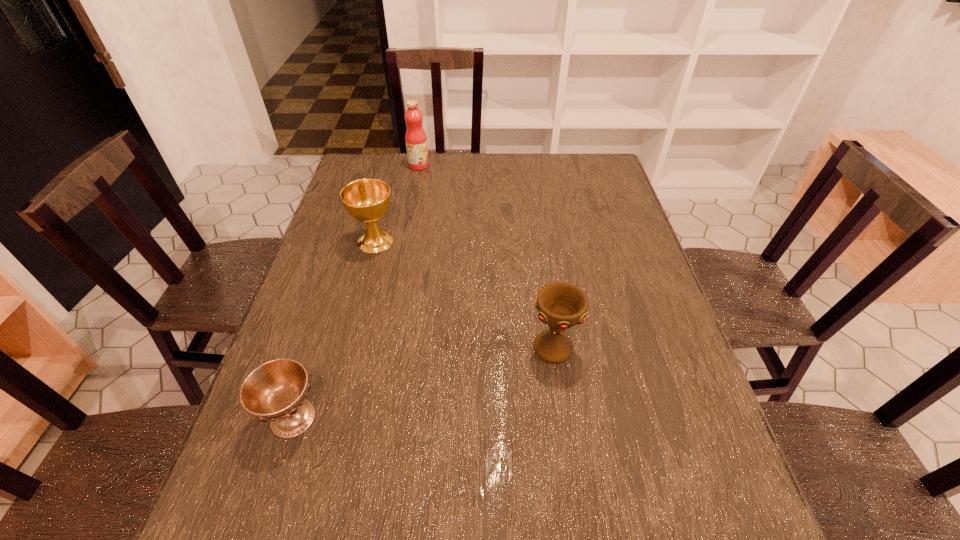
Where is `free location located 0.340m on the right of the shortest chalice`? The image size is (960, 540). free location located 0.340m on the right of the shortest chalice is located at coordinates (491, 418).

The image size is (960, 540). Identify the location of object that is at the far edge. (416, 140).

Where is `vacant space at the left edge of the desktop`? Image resolution: width=960 pixels, height=540 pixels. vacant space at the left edge of the desktop is located at coordinates (314, 474).

You are a GUI agent. You are given a task and a screenshot of the screen. Output one action in this format:
    pyautogui.click(x=<x>, y=<y>)
    Task: Click on the vacant space at the right edge
    
    Given the screenshot: What is the action you would take?
    pyautogui.click(x=641, y=283)

The width and height of the screenshot is (960, 540). Find the location of `vacant space at the near right corner of the desktop`. vacant space at the near right corner of the desktop is located at coordinates (731, 532).

The image size is (960, 540). I want to click on free space between the third farthest object and the farthest object, so tap(487, 257).

You are a GUI agent. You are given a task and a screenshot of the screen. Output one action in this format:
    pyautogui.click(x=<x>, y=<y>)
    Task: Click on the free space between the second nearest object and the shortest chalice
    
    Given the screenshot: What is the action you would take?
    pyautogui.click(x=423, y=383)

Find the location of a particular element. The height and width of the screenshot is (540, 960). vacant area that lies between the nearest object and the fruit juice is located at coordinates (356, 292).

This screenshot has width=960, height=540. In order to click on vacant area that lies between the second farthest object and the third farthest object in this screenshot , I will do `click(465, 295)`.

Identify the location of free spot between the tallest object and the second nearest object. The image size is (960, 540). (487, 257).